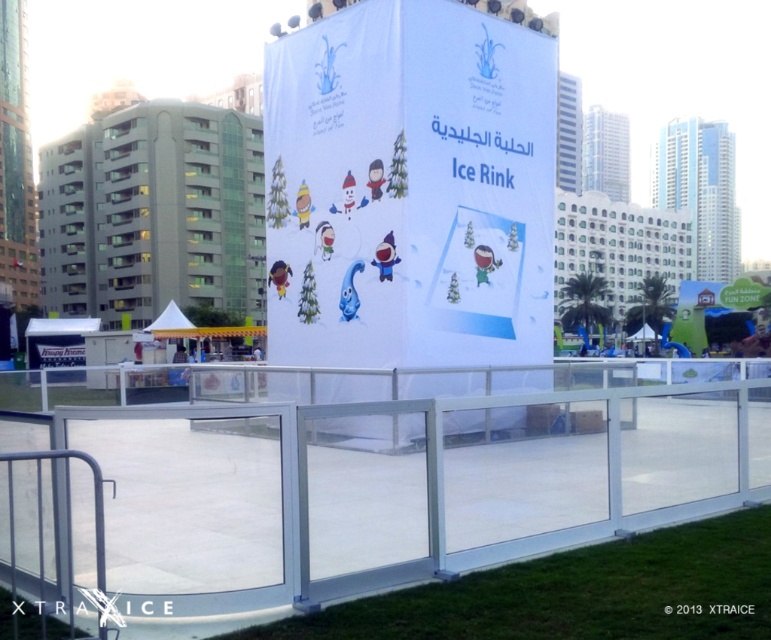
Which of these two, clear plastic rail at center or white paper ice rink at center, stands shorter?

white paper ice rink at center

Is point (285, 582) closer to viewer compared to point (547, 342)?

Yes.

Between point (29, 552) and point (288, 138), which one is positioned in front?

Point (29, 552) is more forward.

What are the coordinates of `clear plastic rail at center` in the screenshot? It's located at (352, 490).